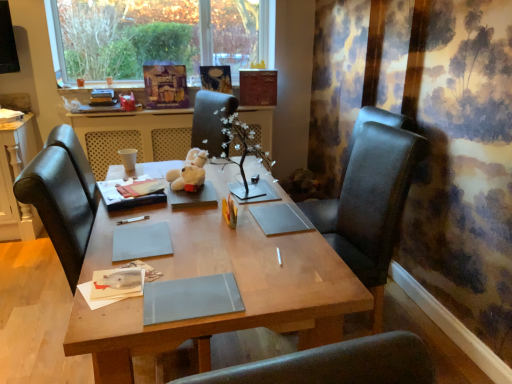
Where is `free spot above wooden desk at center (from a real-world perspective)`? free spot above wooden desk at center (from a real-world perspective) is located at coordinates (202, 224).